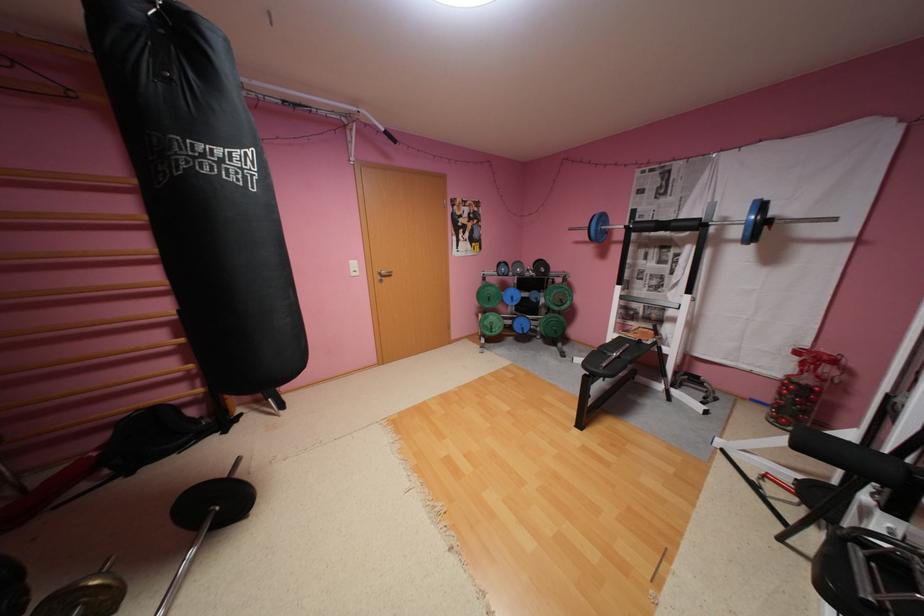
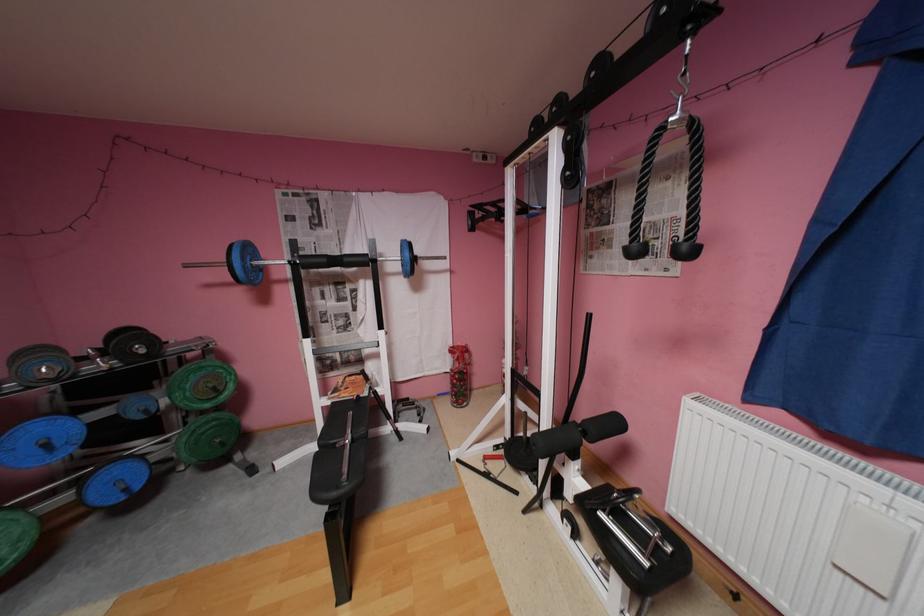
The point at (x=683, y=224) is marked in the first image. Where is the corresponding point in the second image?

(355, 259)